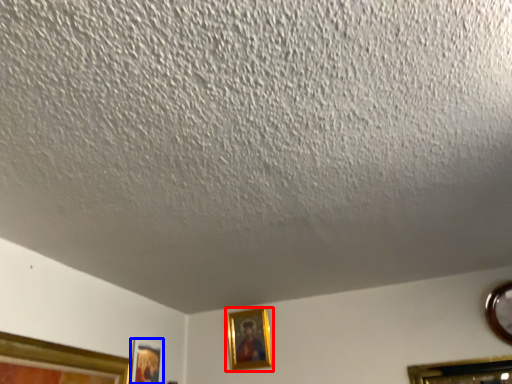
Question: Which of the following is the farthest to the observer, picture frame (highlighted by a red box) or picture frame (highlighted by a blue box)?

Choices:
 (A) picture frame
 (B) picture frame

Answer: (A)